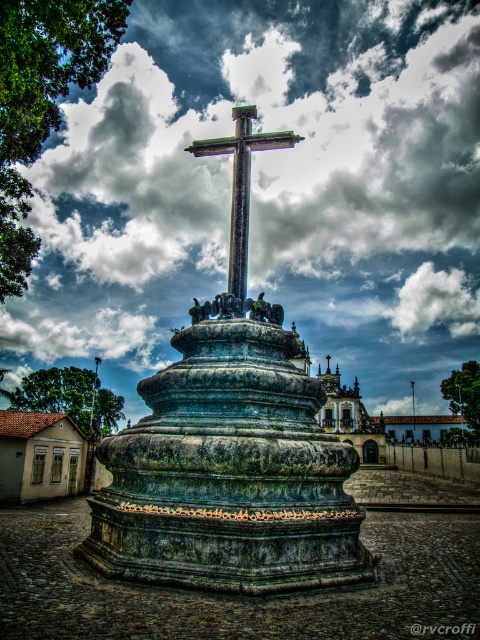
Is point (327, 460) in front of point (236, 272)?

Yes, it is in front of point (236, 272).

Is green stone cross at center bigger than polished stone cross at center?

Yes.

What are the coordinates of `green stone cross at center` in the screenshot? It's located at (229, 445).

Who is more distant from viewer, (291, 112) or (202, 461)?

Positioned behind is point (291, 112).

Who is positioned more to the right, cloudy sky at upper center or green stone cross at center?

From the viewer's perspective, cloudy sky at upper center appears more on the right side.

Between point (421, 301) and point (340, 504), which one is positioned in front?

Point (340, 504) is in front.

Locate an element on the screen. The height and width of the screenshot is (640, 480). cloudy sky at upper center is located at coordinates (266, 189).

Who is positioned more to the left, cloudy sky at upper center or polished stone cross at center?

polished stone cross at center

Between point (351, 64) and point (235, 188), which one is positioned in front?

Point (235, 188) is more forward.

Locate an element on the screen. The image size is (480, 640). cloudy sky at upper center is located at coordinates (266, 189).